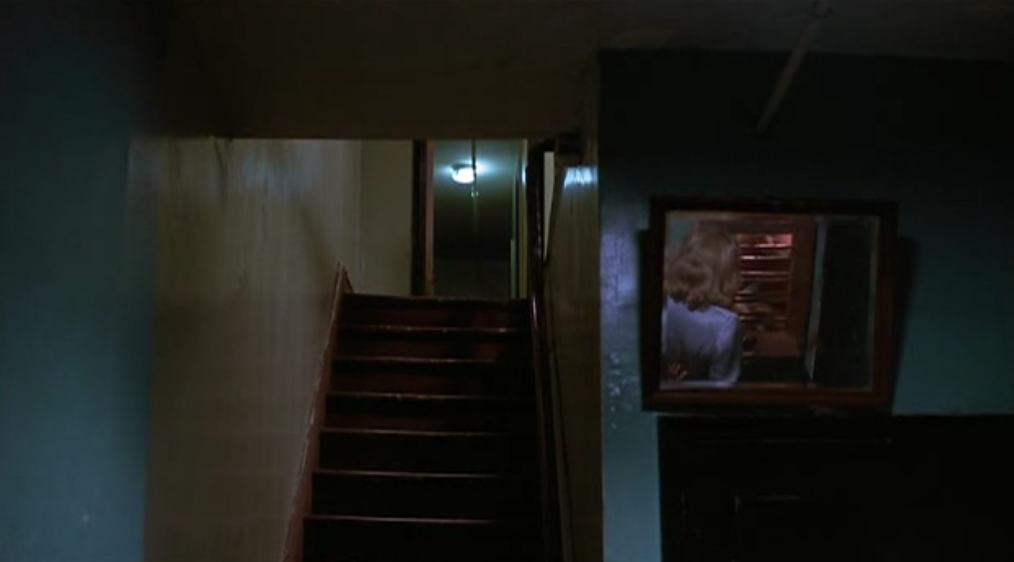
Where is `frame`? The width and height of the screenshot is (1014, 562). frame is located at coordinates (649, 338).